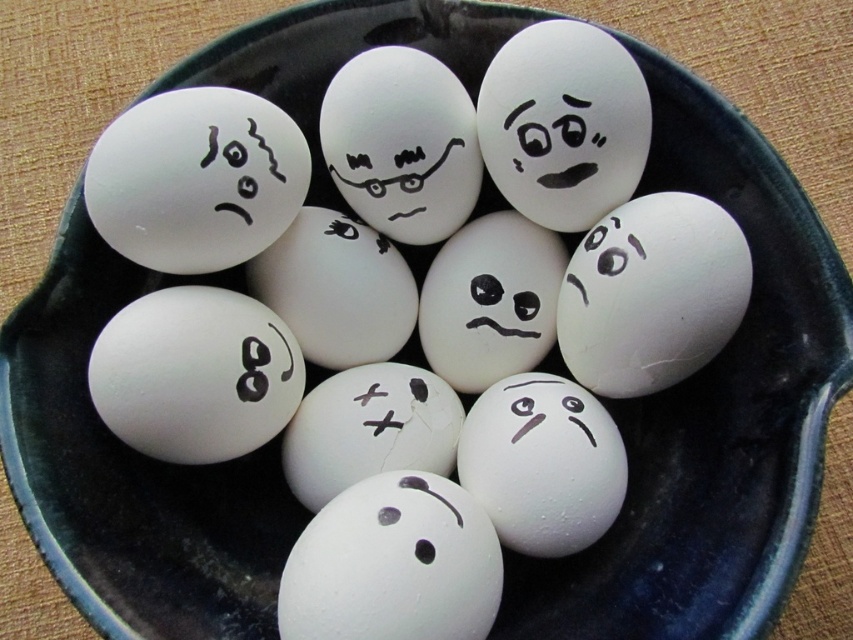
You are arranging eggs in a bowl and notice two eggs labeled as the white matte egg at upper center and the white matte egg at center. Which of these two eggs is closer to you?

The white matte egg at upper center is closer to you because it is positioned in front of the white matte egg at center.

You are an artist planning to stack the white matte egg at upper center and the white matte egg at center on top of each other. Which egg should be placed at the bottom to ensure stability?

The white matte egg at upper center has a greater height compared to the white matte egg at center. To ensure stability, the taller white matte egg at upper center should be placed at the bottom as its larger base will provide better support.

You are organizing a childrens party and need to arrange the white matte egg at upper center and the white matte egg at center on a shelf. Which egg should you place first if you want to follow the rule of placing larger items first?

The white matte egg at upper center should be placed first because it is larger than the white matte egg at center.